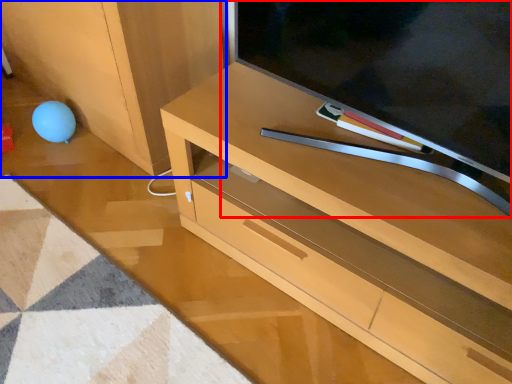
Question: Which object is closer to the camera taking this photo, television (highlighted by a red box) or cabinetry (highlighted by a blue box)?

Choices:
 (A) television
 (B) cabinetry

Answer: (A)